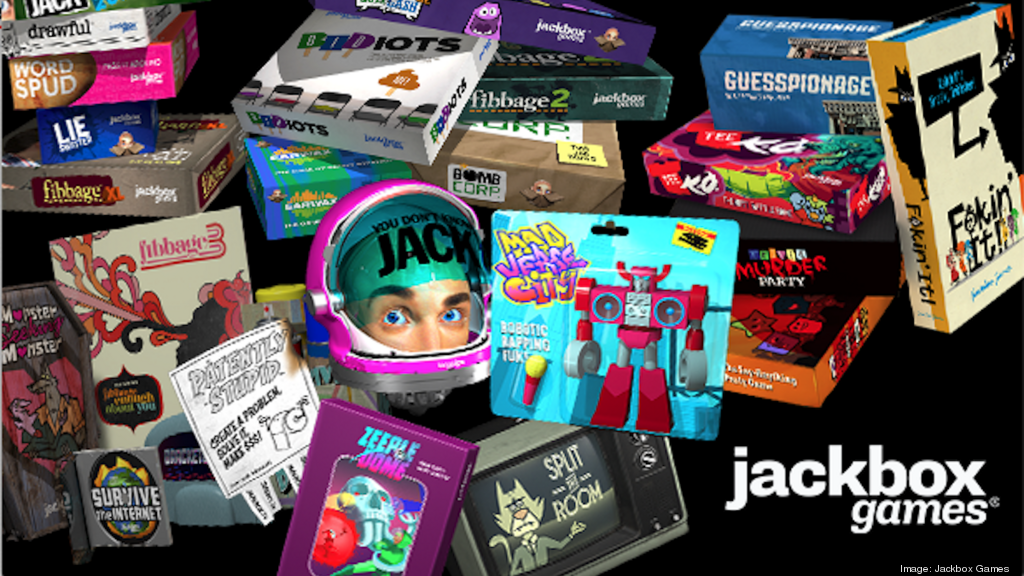
Identify the location of upper tv channel knob. Image resolution: width=1024 pixels, height=576 pixels. point(639,437).